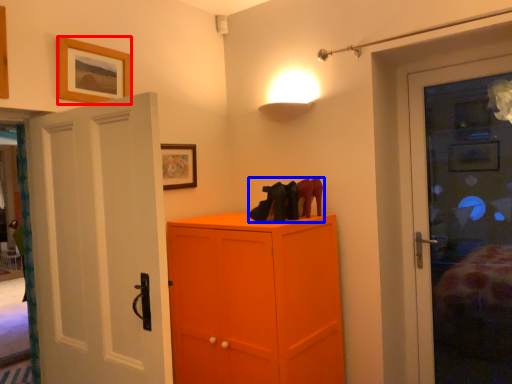
Question: Among these objects, which one is nearest to the camera, picture frame (highlighted by a red box) or footwear (highlighted by a blue box)?

Choices:
 (A) picture frame
 (B) footwear

Answer: (A)